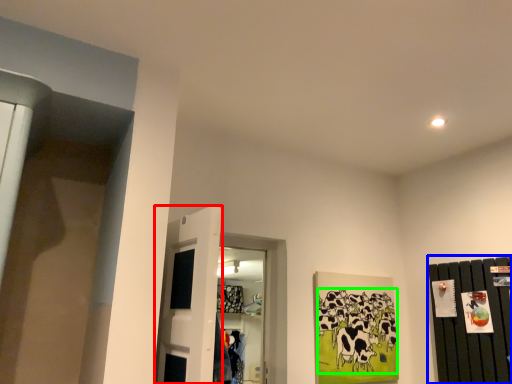
Question: Which object is positioned closest to door (highlighted by a red box)? Select from dresser (highlighted by a blue box) and animal (highlighted by a green box).

Choices:
 (A) dresser
 (B) animal

Answer: (B)